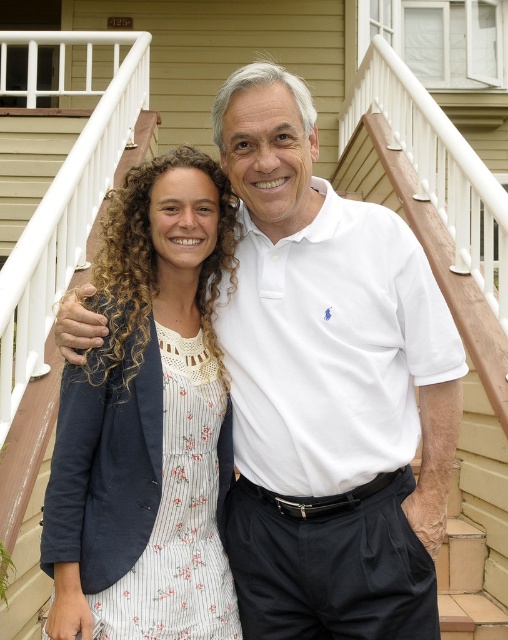
How distant is white floral dress at center from wooden at center?

white floral dress at center and wooden at center are 4.20 meters apart from each other.

Is point (137, 308) positioned before point (491, 332)?

Yes, point (137, 308) is in front of point (491, 332).

Where is `white floral dress at center`? This screenshot has height=640, width=508. white floral dress at center is located at coordinates (148, 420).

Find the location of a particular element. The height and width of the screenshot is (640, 508). white floral dress at center is located at coordinates (148, 420).

Is white cotton polo shirt at center closer to camera compared to white floral dress at center?

No, it is behind white floral dress at center.

Is white cotton polo shirt at center thinner than white floral dress at center?

No, white cotton polo shirt at center is not thinner than white floral dress at center.

Is point (282, 442) in front of point (217, 580)?

No, it is behind (217, 580).

The height and width of the screenshot is (640, 508). Identify the location of white cotton polo shirt at center. (329, 387).

Is point (423, 508) farther from camera compared to point (468, 400)?

No.

Between point (331, 436) and point (502, 493), which one is positioned behind?

Point (502, 493)

What are the coordinates of `white cotton polo shirt at center` in the screenshot? It's located at (329, 387).